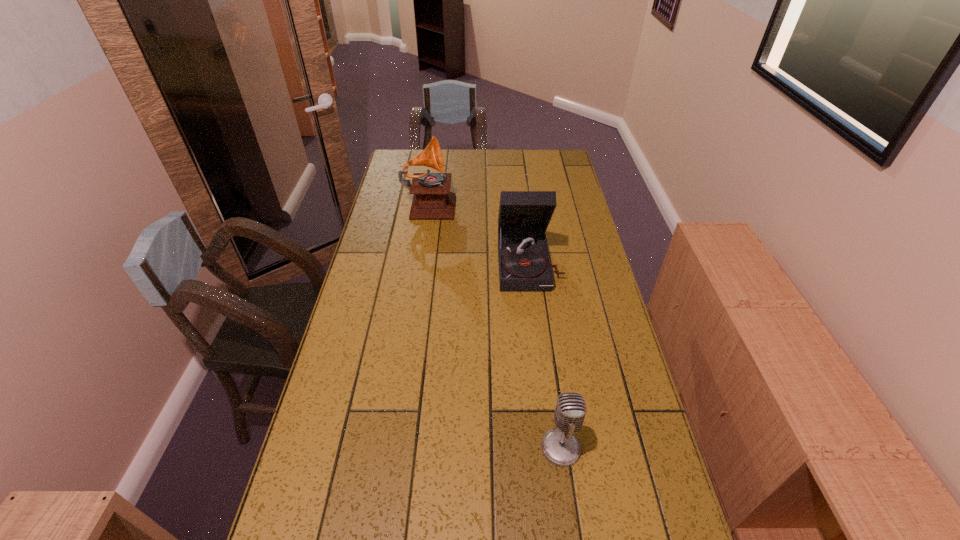
Identify the location of free space that satisfies the following two spatial constraints: 1. on the back side of the nearest object; 2. on the horn of the leftmost object. (527, 202).

You are a GUI agent. You are given a task and a screenshot of the screen. Output one action in this format:
    pyautogui.click(x=<x>, y=<y>)
    Task: Click on the blank space that satisfies the following two spatial constraints: 1. on the front-facing side of the microphone; 2. on the right side of the nearer phonograph_record
    This screenshot has width=960, height=540.
    Given the screenshot: What is the action you would take?
    pyautogui.click(x=552, y=448)

I want to click on free point that satisfies the following two spatial constraints: 1. on the horn of the microphone; 2. on the right side of the leftmost object, so click(x=393, y=448).

Identify the location of vacant space that satisfies the following two spatial constraints: 1. on the horn of the farther phonograph_record; 2. on the back side of the microphone. (393, 448).

Locate an element on the screen. This screenshot has height=540, width=960. free spot that satisfies the following two spatial constraints: 1. on the horn of the left phonograph_record; 2. on the left side of the nearest object is located at coordinates (393, 448).

This screenshot has height=540, width=960. In order to click on free space that satisfies the following two spatial constraints: 1. on the horn of the farthest object; 2. on the right side of the microphone in this screenshot , I will do `click(393, 448)`.